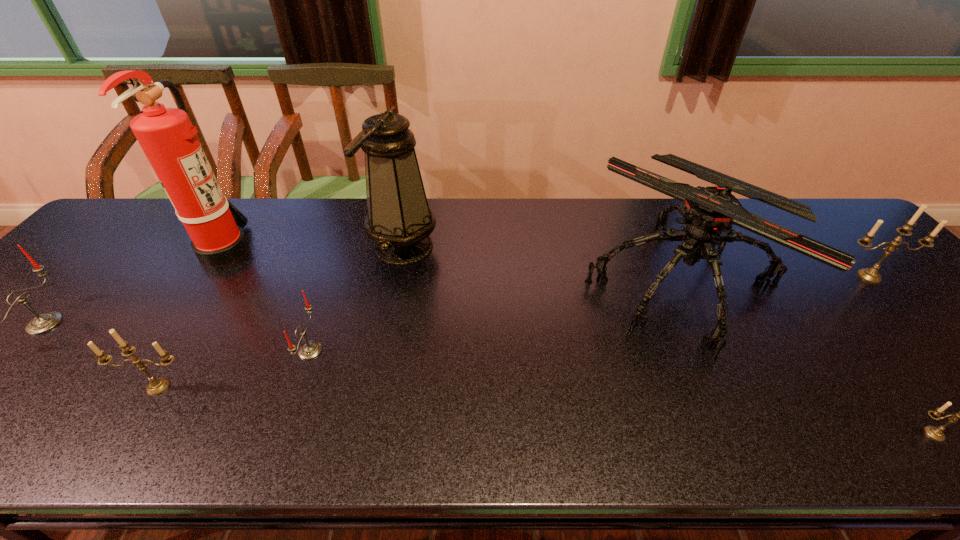
Find the location of a particular element. This screenshot has width=960, height=540. vacant point that satisfies the following two spatial constraints: 1. on the front side of the black drone; 2. on the front-facing side of the leftmost candle is located at coordinates (700, 323).

Find the location of a particular element. This screenshot has height=540, width=960. free location that satisfies the following two spatial constraints: 1. at the nozzle of the fire extinguisher; 2. on the back side of the black drone is located at coordinates (203, 284).

At what (x,y) coordinates should I click in order to perform the action: click on vacant region that satisfies the following two spatial constraints: 1. on the back side of the leftmost metallic candle; 2. at the nozzle of the red fire extinguisher. Please return your answer as a coordinate pair (x, y). Looking at the image, I should click on (244, 249).

This screenshot has width=960, height=540. I want to click on free space that satisfies the following two spatial constraints: 1. at the nozzle of the tallest object; 2. on the right side of the rightmost metallic candle, so click(207, 276).

Identify the location of vacant space that satisfies the following two spatial constraints: 1. at the nozzle of the tallest object; 2. on the back side of the leftmost metallic candle. click(134, 387).

At what (x,y) coordinates should I click in order to perform the action: click on free space that satisfies the following two spatial constraints: 1. at the nozzle of the second nearest object; 2. on the left side of the red fire extinguisher. Please return your answer as a coordinate pair (x, y). This screenshot has width=960, height=540. Looking at the image, I should click on (134, 387).

Identify the location of free spot that satisfies the following two spatial constraints: 1. on the front side of the oil lamp; 2. on the front-facing side of the bigger red candle. (388, 323).

I want to click on free space that satisfies the following two spatial constraints: 1. on the front side of the oil lamp; 2. on the right side of the sixth object from left to right, so click(x=396, y=284).